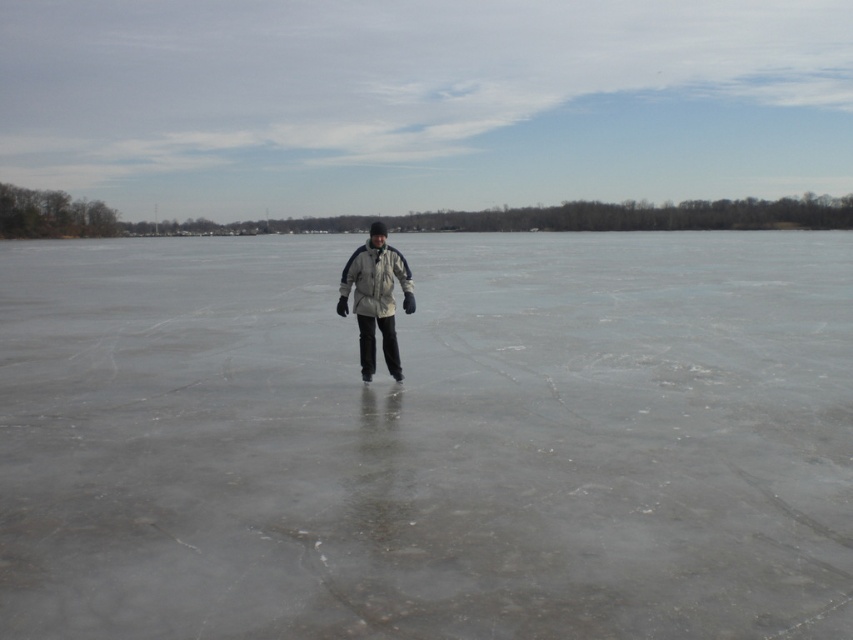
Question: Which point is farther to the camera?

Choices:
 (A) transparent ice at center
 (B) white matte jacket at center

Answer: (B)

Question: Does transparent ice at center appear over white matte jacket at center?

Choices:
 (A) yes
 (B) no

Answer: (A)

Question: Does transparent ice at center have a larger size compared to white matte jacket at center?

Choices:
 (A) no
 (B) yes

Answer: (B)

Question: Observing the image, what is the correct spatial positioning of transparent ice at center in reference to white matte jacket at center?

Choices:
 (A) below
 (B) above

Answer: (B)